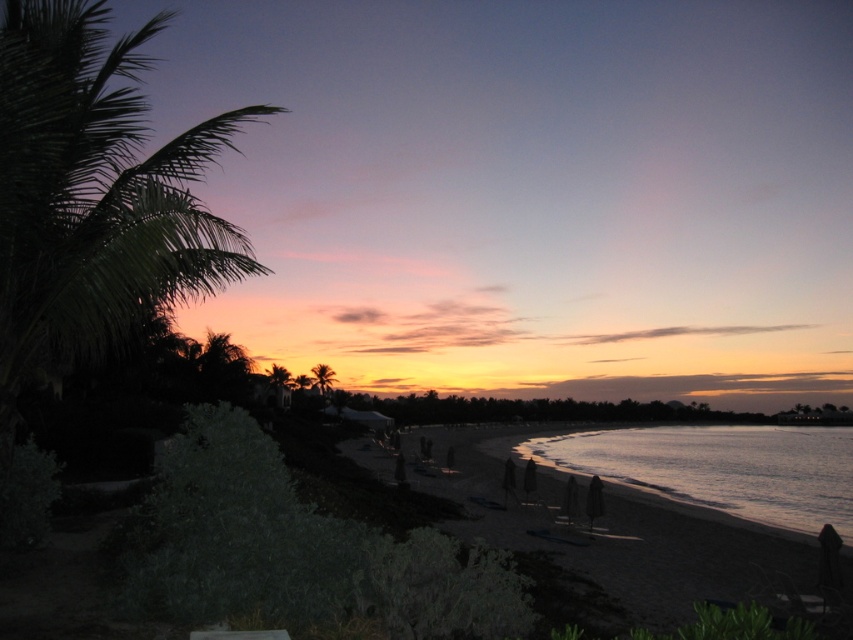
You are standing on the beach and want to take a photo of the silvery reflective water at lower right and the green leafy palm tree at center. Which object will appear closer to the camera in the photo?

The silvery reflective water at lower right will appear closer to the camera because it is in front of the green leafy palm tree at center.

You are planning to set up a small tent for a night stay at the beach. Given the smooth sand beach at lower right and the green leafy palm tree at center, which location would provide more space for your tent?

The smooth sand beach at lower right has a larger size compared to the green leafy palm tree at center, so it would provide more space for your tent.

You are standing on the beach and want to take a photo of the green leafy palm tree at left and the silvery reflective water at lower right. Which object should you focus on first if you want to capture both in a single frame without moving your camera?

The green leafy palm tree at left is taller than the silvery reflective water at lower right, so you should focus on the green leafy palm tree at left first to ensure it fits within the frame.